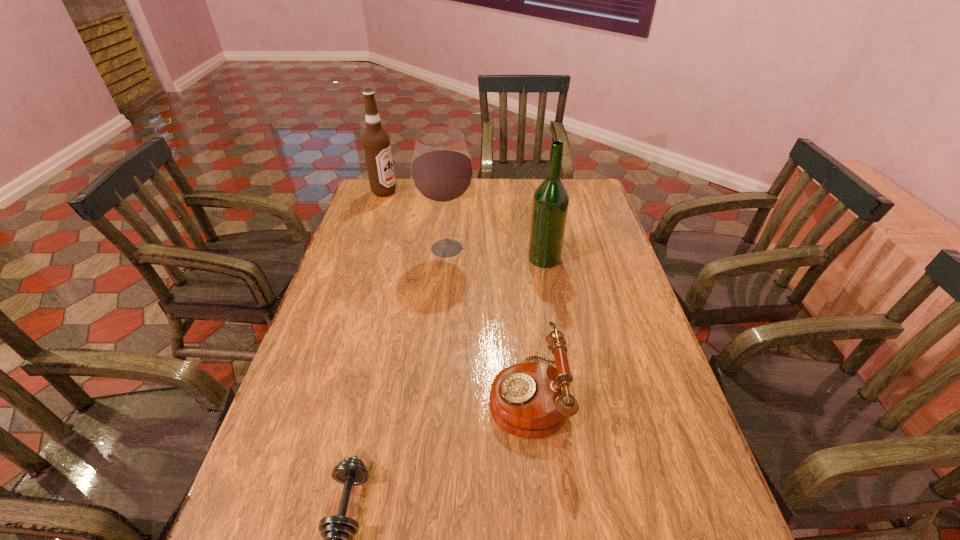
You are a GUI agent. You are given a task and a screenshot of the screen. Output one action in this format:
    pyautogui.click(x=<x>, y=<y>)
    Task: Click on the farthest alcohol
    
    Given the screenshot: What is the action you would take?
    pyautogui.click(x=376, y=142)

At what (x,y) coordinates should I click in order to perform the action: click on the farthest object. Please return your answer as a coordinate pair (x, y). The height and width of the screenshot is (540, 960). Looking at the image, I should click on (376, 142).

Where is `the rightmost alcohol`? the rightmost alcohol is located at coordinates (550, 204).

Identify the location of the third object from left to right. The image size is (960, 540). (442, 172).

Locate an element on the screen. Image resolution: width=960 pixels, height=540 pixels. the fourth tallest object is located at coordinates (531, 399).

Where is `the fourth farthest object`? The image size is (960, 540). the fourth farthest object is located at coordinates (531, 399).

Where is `vacant space situated on the label of the leftmost alcohol`? vacant space situated on the label of the leftmost alcohol is located at coordinates (440, 192).

Locate an element on the screen. vacant space located on the left of the rightmost alcohol is located at coordinates coord(424,258).

Where is `free space located 0.250m on the right of the third object from right to left`? This screenshot has height=540, width=960. free space located 0.250m on the right of the third object from right to left is located at coordinates [x=549, y=248].

Identify the location of vacant space located on the dial of the telephone. This screenshot has width=960, height=540. (451, 395).